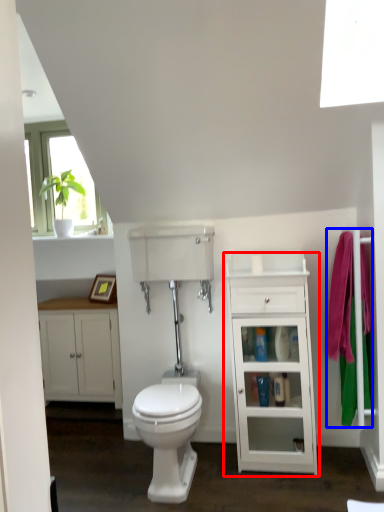
Question: Which of the following is the farthest to the observer, cabinetry (highlighted by a red box) or bath towel (highlighted by a blue box)?

Choices:
 (A) cabinetry
 (B) bath towel

Answer: (A)